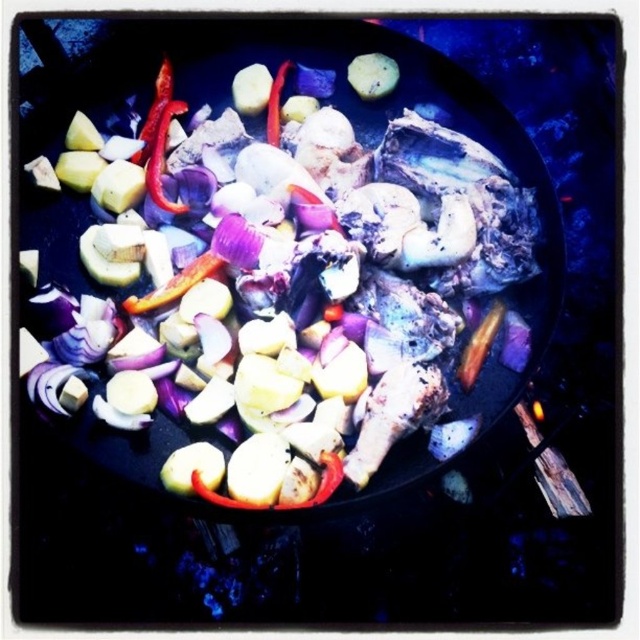
Does point (536, 227) come in front of point (148, 182)?

Yes, it is in front of point (148, 182).

Locate an element on the screen. The height and width of the screenshot is (640, 640). black matte wok at center is located at coordinates (278, 259).